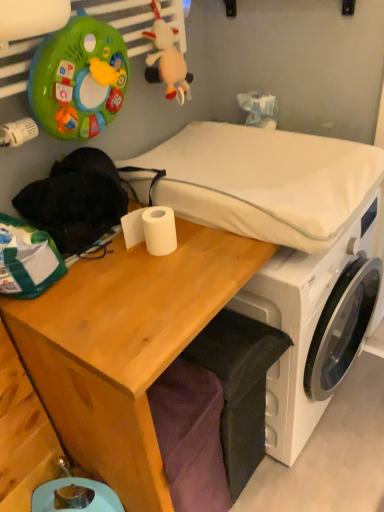
Question: Does point (125, 329) appear closer or farther from the camera than point (314, 195)?

Choices:
 (A) closer
 (B) farther

Answer: (A)

Question: In the image, is wooden desk at center positioned in front of or behind white plastic washing machine at center?

Choices:
 (A) front
 (B) behind

Answer: (A)

Question: Which object is positioned closest to the white matte toilet paper at center?

Choices:
 (A) white fabric mattress at center
 (B) white plastic washing machine at center
 (C) wooden desk at center

Answer: (C)

Question: Which object is positioned farthest from the white matte toilet paper at center?

Choices:
 (A) white fabric mattress at center
 (B) wooden desk at center
 (C) white plastic washing machine at center

Answer: (C)